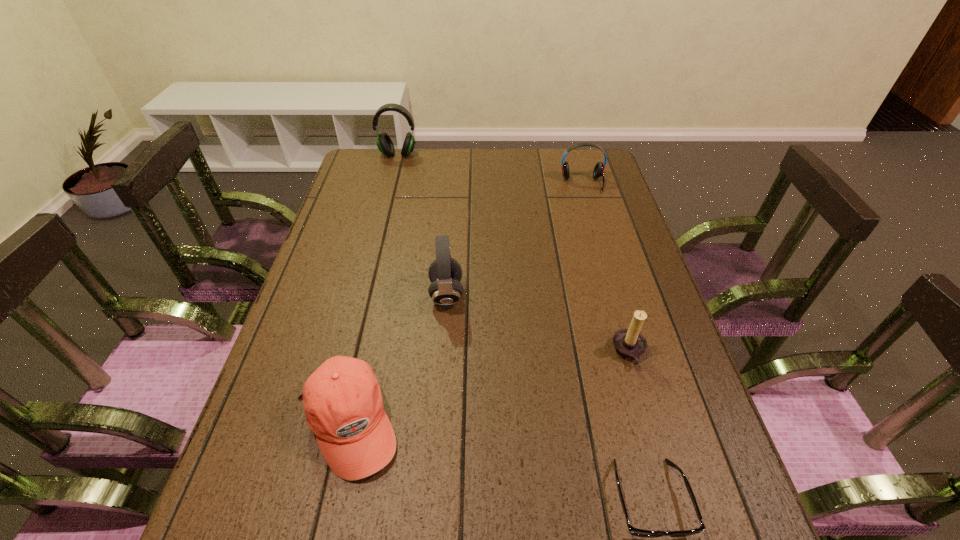
Identify the location of free space between the rightmost headset and the baseball cap. (466, 303).

Locate an element on the screen. Image resolution: width=960 pixels, height=540 pixels. the closest object to the fourth object from right to left is located at coordinates (342, 399).

Locate which object ranks third in proximity to the baseball cap. Please provide its 2D coordinates. Your answer should be formatted as a tuple, i.e. [(x, y)], where the tuple contains the x and y coordinates of a point satisfying the conditions above.

[(629, 343)]

You are a GUI agent. You are given a task and a screenshot of the screen. Output one action in this format:
    pyautogui.click(x=<x>, y=<y>)
    Task: Click on the second closest headset relative to the baseball cap
    
    Given the screenshot: What is the action you would take?
    (598, 171)

At what (x,y) coordinates should I click in order to perform the action: click on the third closest headset relative to the shortest object. Please return your answer as a coordinate pair (x, y). This screenshot has width=960, height=540. Looking at the image, I should click on (385, 145).

At what (x,y) coordinates should I click in order to perform the action: click on vacant region that satisfies the following two spatial constraints: 1. on the ear cups of the nearest headset; 2. on the front side of the baseball cap. Please return your answer as a coordinate pair (x, y). This screenshot has width=960, height=540. Looking at the image, I should click on (437, 423).

Identify the location of free spot that satisfies the following two spatial constraints: 1. on the ear cups of the nearest headset; 2. on the front side of the baseball cap. (437, 423).

Locate an element on the screen. vacant point that satisfies the following two spatial constraints: 1. on the ear cups of the baseball cap; 2. on the left side of the farthest headset is located at coordinates (328, 423).